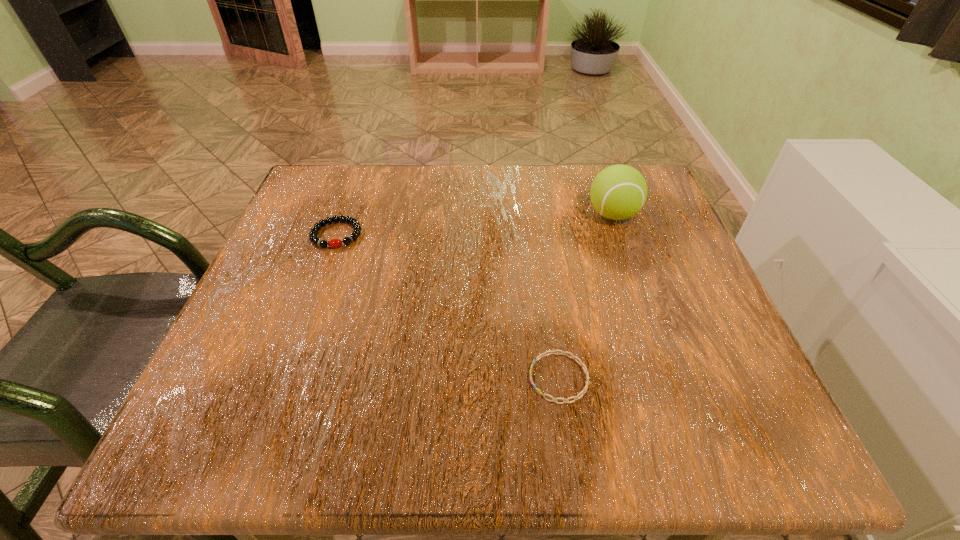
Find the location of `the tallest object`. the tallest object is located at coordinates (618, 192).

Locate an element on the screen. The width and height of the screenshot is (960, 540). tennis ball is located at coordinates (618, 192).

Find the location of a particular element. The width and height of the screenshot is (960, 540). the taller bracelet is located at coordinates (355, 224).

Where is `the left bracelet`? the left bracelet is located at coordinates (355, 224).

Identify the location of the right bracelet. Image resolution: width=960 pixels, height=540 pixels. (581, 363).

Where is `the shortest object`? This screenshot has height=540, width=960. the shortest object is located at coordinates (x=581, y=363).

The image size is (960, 540). I want to click on vacant space situated 0.240m on the left of the rightmost object, so click(x=478, y=214).

This screenshot has width=960, height=540. In order to click on vacant space located on the right of the taller bracelet in this screenshot , I will do `click(463, 234)`.

Where is `free space located 0.270m on the surface of the shorter bracelet showing star-shaped elements`? free space located 0.270m on the surface of the shorter bracelet showing star-shaped elements is located at coordinates (354, 378).

What are the coordinates of `free region located on the surface of the shorter bracelet showing star-shaped elements` in the screenshot? It's located at (406, 378).